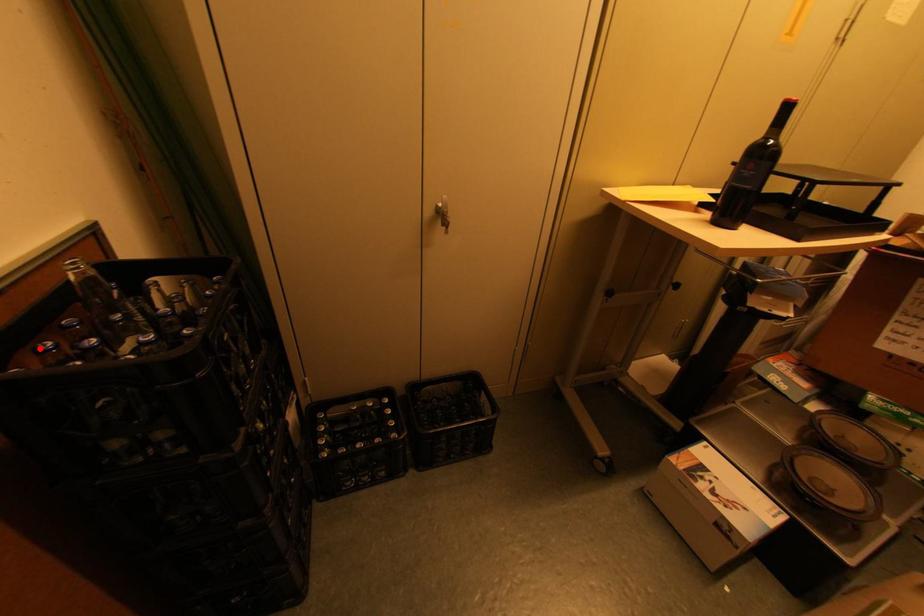
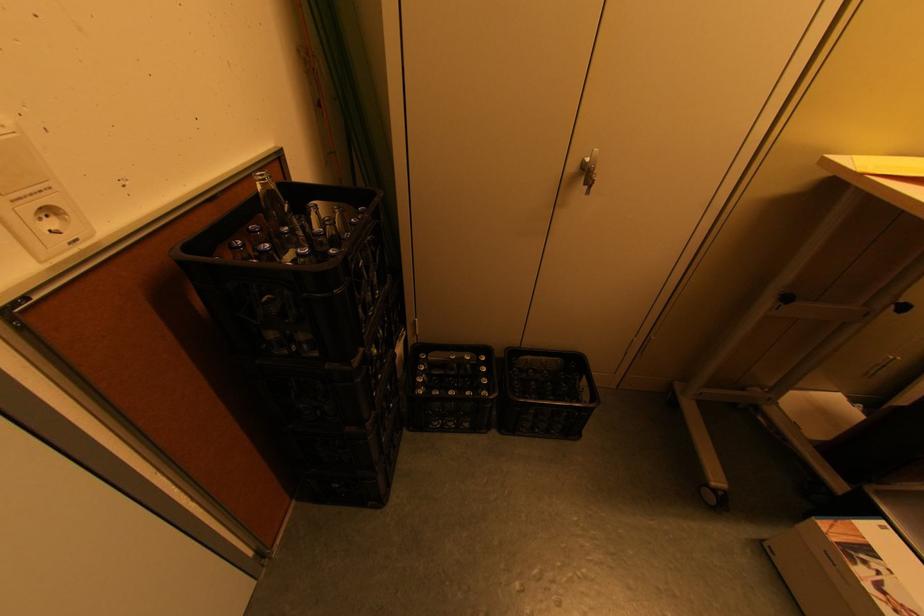
Find the pixel in the second image that matches the highlighted location in the first image.

(234, 244)